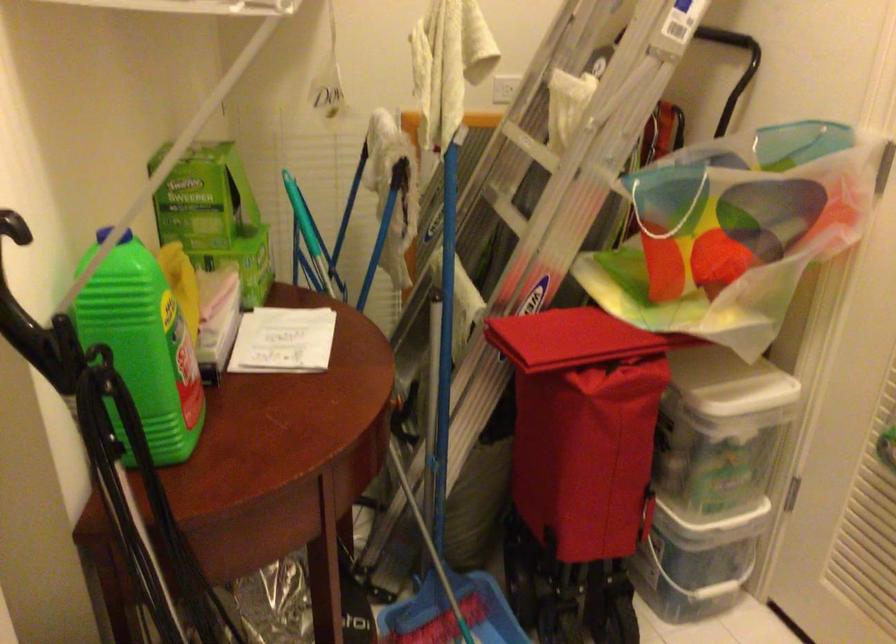
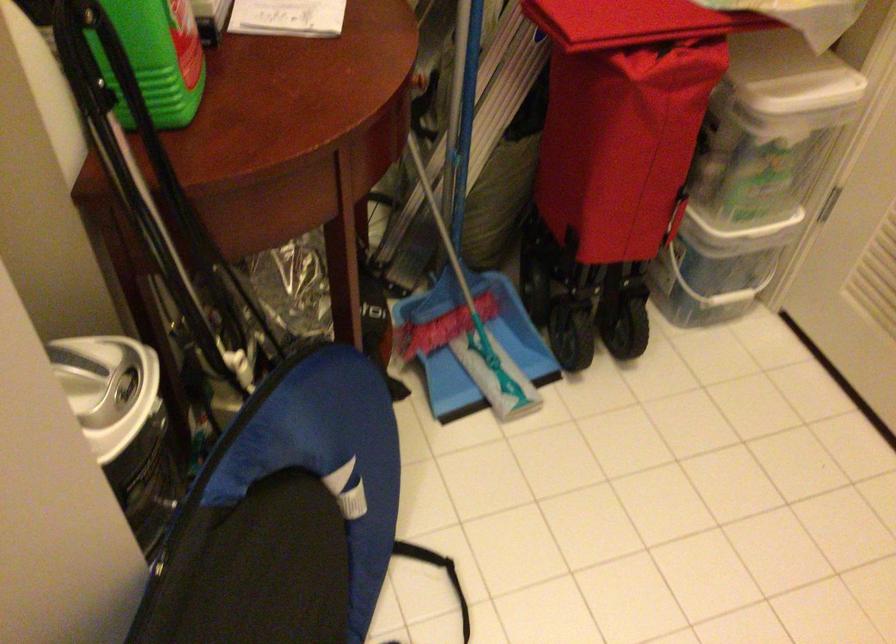
The point at [162,406] is marked in the first image. Where is the corresponding point in the second image?

(156, 59)